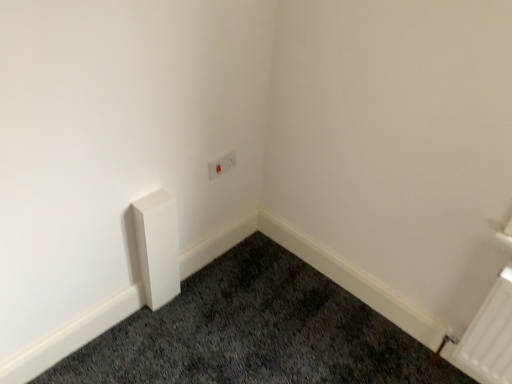
Describe the element at coordinates (222, 165) in the screenshot. I see `white plastic light switch at upper center` at that location.

The image size is (512, 384). In order to click on white plastic light switch at upper center in this screenshot , I will do `click(222, 165)`.

Identify the location of white plastic light switch at upper center. The height and width of the screenshot is (384, 512). 222,165.